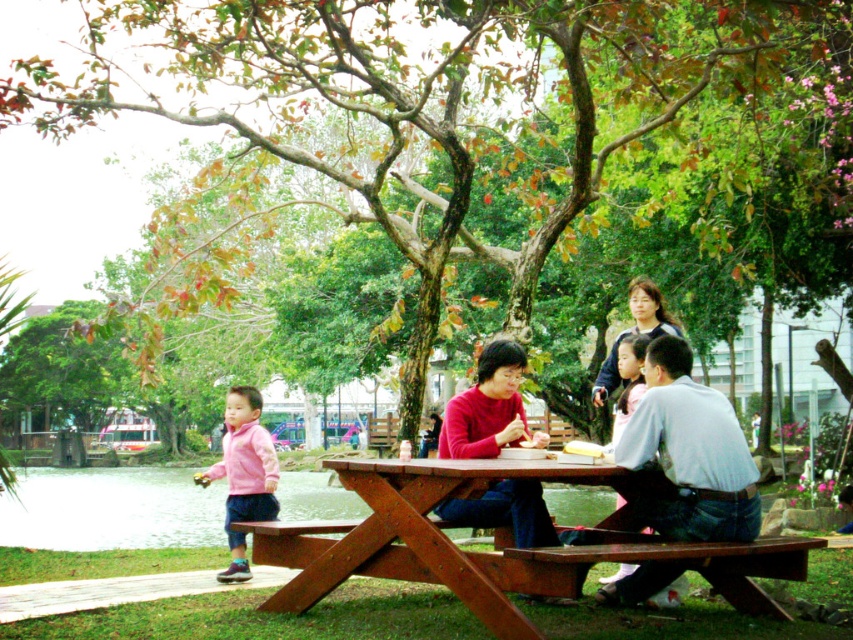
Question: Does wooden picnic table at center lie in front of white cotton shirt at center?

Choices:
 (A) no
 (B) yes

Answer: (B)

Question: Estimate the real-world distances between objects in this image. Which object is closer to the wooden picnic table at center?

Choices:
 (A) pink fleece jacket at lower left
 (B) white cotton shirt at center
 (C) matte red sweater at center

Answer: (C)

Question: Among these points, which one is nearest to the camera?

Choices:
 (A) (428, 524)
 (B) (253, 461)
 (C) (506, 484)
 (D) (701, 528)

Answer: (A)

Question: Does matte red sweater at center appear over brown wooden bench at lower center?

Choices:
 (A) no
 (B) yes

Answer: (B)

Question: Among these objects, which one is nearest to the camera?

Choices:
 (A) brown wooden bench at lower center
 (B) pink fleece jacket at lower left
 (C) wooden picnic table at center
 (D) brown wooden picnic table at center

Answer: (D)

Question: Is wooden picnic table at center positioned at the back of brown wooden bench at lower center?

Choices:
 (A) yes
 (B) no

Answer: (A)